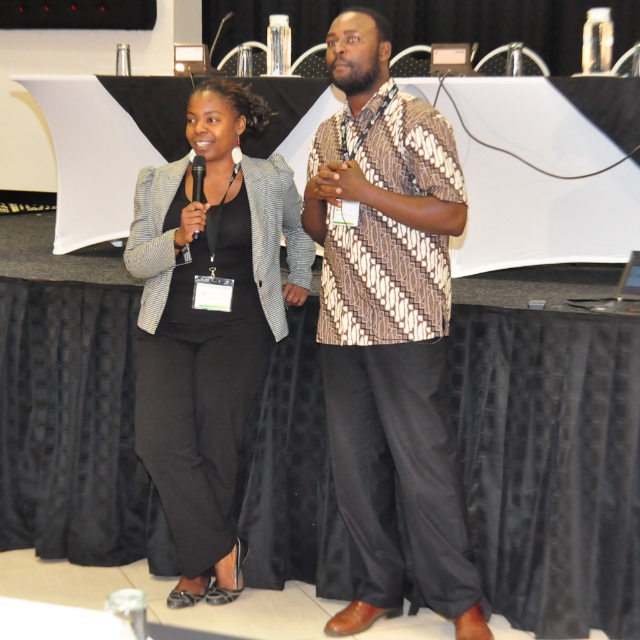
Question: Which object is farther from the camera taking this photo?

Choices:
 (A) patterned fabric shirt at center
 (B) matte black blazer at center
 (C) black plastic microphone at center
 (D) black fabric table at center

Answer: (B)

Question: Which object appears farthest from the camera in this image?

Choices:
 (A) black plastic microphone at center
 (B) black fabric table at center
 (C) patterned fabric shirt at center

Answer: (A)

Question: Does patterned fabric shirt at center have a smaller size compared to matte black blazer at center?

Choices:
 (A) yes
 (B) no

Answer: (B)

Question: Is the position of black fabric table at center more distant than that of matte black blazer at center?

Choices:
 (A) no
 (B) yes

Answer: (A)

Question: Estimate the real-world distances between objects in this image. Which object is farther from the black plastic microphone at center?

Choices:
 (A) matte black blazer at center
 (B) black fabric table at center

Answer: (B)

Question: Is patterned fabric shirt at center smaller than black plastic microphone at center?

Choices:
 (A) no
 (B) yes

Answer: (A)